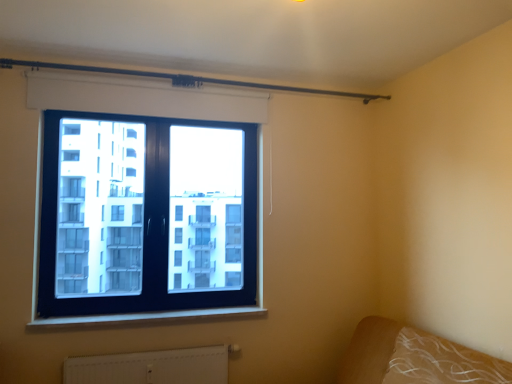
Describe the element at coordinates (147, 317) in the screenshot. This screenshot has width=512, height=384. I see `white plastic window sill at lower center` at that location.

Describe the element at coordinates (151, 367) in the screenshot. I see `white textured radiator at lower center` at that location.

What do you see at coordinates (414, 358) in the screenshot? I see `brown fabric bed at lower right` at bounding box center [414, 358].

Identify the location of white plastic window sill at lower center. (147, 317).

Does point (410, 375) appear closer or farther from the camera than point (158, 318)?

Point (410, 375) is closer to the camera than point (158, 318).

Is brown fabric bed at lower right next to white plastic window sill at lower center and touching it?

No, brown fabric bed at lower right is not next to white plastic window sill at lower center.

From the picture: Can you confirm if brown fabric bed at lower right is bigger than white plastic window sill at lower center?

Correct, brown fabric bed at lower right is larger in size than white plastic window sill at lower center.

Choose the correct answer: Is brown fabric bed at lower right inside white plastic window sill at lower center or outside it?

brown fabric bed at lower right is not inside white plastic window sill at lower center, it's outside.

Consider the image. From the image's perspective, which one is positioned lower, white plastic window sill at lower center or brown fabric bed at lower right?

brown fabric bed at lower right.

Considering the sizes of white plastic window sill at lower center and brown fabric bed at lower right in the image, is white plastic window sill at lower center bigger or smaller than brown fabric bed at lower right?

In the image, white plastic window sill at lower center appears to be smaller than brown fabric bed at lower right.

Which is more to the right, white plastic window sill at lower center or brown fabric bed at lower right?

Positioned to the right is brown fabric bed at lower right.

From the picture: Can you confirm if white plastic window sill at lower center is taller than brown fabric bed at lower right?

In fact, white plastic window sill at lower center may be shorter than brown fabric bed at lower right.

Is white textured radiator at lower center further to the viewer compared to white plastic window sill at lower center?

No, it is in front of white plastic window sill at lower center.

Who is smaller, white textured radiator at lower center or white plastic window sill at lower center?

white plastic window sill at lower center is smaller.

What are the coordinates of `window sill positioned vertically above the white textured radiator at lower center (from a real-world perspective)` in the screenshot? It's located at (147, 317).

Who is shorter, brown fabric bed at lower right or black glass window at upper left?

brown fabric bed at lower right.

From a real-world perspective, is brown fabric bed at lower right under black glass window at upper left?

Indeed, from a real-world perspective, brown fabric bed at lower right is positioned beneath black glass window at upper left.

Considering the relative positions of brown fabric bed at lower right and black glass window at upper left in the image provided, is brown fabric bed at lower right to the left of black glass window at upper left from the viewer's perspective?

No, brown fabric bed at lower right is not to the left of black glass window at upper left.

In the scene shown: Does brown fabric bed at lower right have a lesser width compared to metallic rod at upper center?

Incorrect, the width of brown fabric bed at lower right is not less than that of metallic rod at upper center.

Looking at this image, is brown fabric bed at lower right taller or shorter than metallic rod at upper center?

Considering their sizes, brown fabric bed at lower right has more height than metallic rod at upper center.

From the picture: Is brown fabric bed at lower right looking in the opposite direction of metallic rod at upper center?

No.

Is metallic rod at upper center wider than white plastic window sill at lower center?

In fact, metallic rod at upper center might be narrower than white plastic window sill at lower center.

Is white plastic window sill at lower center inside metallic rod at upper center?

No, white plastic window sill at lower center is located outside of metallic rod at upper center.

From a real-world perspective, between metallic rod at upper center and white plastic window sill at lower center, who is vertically higher?

In real-world perspective, metallic rod at upper center is above.

In the scene shown: Are metallic rod at upper center and white plastic window sill at lower center making contact?

metallic rod at upper center and white plastic window sill at lower center are not in contact.

Would you say black glass window at upper left is to the left or to the right of brown fabric bed at lower right in the picture?

In the image, black glass window at upper left appears on the left side of brown fabric bed at lower right.

In terms of size, does black glass window at upper left appear bigger or smaller than brown fabric bed at lower right?

black glass window at upper left is smaller than brown fabric bed at lower right.

Considering the sizes of objects black glass window at upper left and brown fabric bed at lower right in the image provided, who is shorter, black glass window at upper left or brown fabric bed at lower right?

Standing shorter between the two is brown fabric bed at lower right.

From the image's perspective, which one is positioned lower, black glass window at upper left or brown fabric bed at lower right?

From the image's view, brown fabric bed at lower right is below.

You are a GUI agent. You are given a task and a screenshot of the screen. Output one action in this format:
    pyautogui.click(x=<x>, y=<y>)
    Task: Click on the window sill above the brown fabric bed at lower right (from the image's perspective)
    The height and width of the screenshot is (384, 512).
    Given the screenshot: What is the action you would take?
    click(147, 317)

The width and height of the screenshot is (512, 384). Identify the location of bed frame that is in front of the white plastic window sill at lower center. (414, 358).

Which object lies further to the anchor point metallic rod at upper center, black glass window at upper left or brown fabric bed at lower right?

brown fabric bed at lower right is further to metallic rod at upper center.

Looking at the image, which one is located further to white textured radiator at lower center, black glass window at upper left or white plastic window sill at lower center?

The object further to white textured radiator at lower center is black glass window at upper left.

Looking at the image, which one is located closer to white textured radiator at lower center, metallic rod at upper center or white plastic window sill at lower center?

white plastic window sill at lower center.

Which object lies further to the anchor point white textured radiator at lower center, brown fabric bed at lower right or black glass window at upper left?

black glass window at upper left is further to white textured radiator at lower center.

Which object lies further to the anchor point metallic rod at upper center, white plastic window sill at lower center or black glass window at upper left?

The object further to metallic rod at upper center is white plastic window sill at lower center.

From the image, which object appears to be farther from white textured radiator at lower center, white plastic window sill at lower center or metallic rod at upper center?

metallic rod at upper center lies further to white textured radiator at lower center than the other object.

Estimate the real-world distances between objects in this image. Which object is closer to white textured radiator at lower center, brown fabric bed at lower right or white plastic window sill at lower center?

white plastic window sill at lower center is closer to white textured radiator at lower center.

Estimate the real-world distances between objects in this image. Which object is further from black glass window at upper left, white textured radiator at lower center or metallic rod at upper center?

white textured radiator at lower center is positioned further to the anchor black glass window at upper left.

Identify the location of bed frame between metallic rod at upper center and white textured radiator at lower center in the vertical direction. The height and width of the screenshot is (384, 512). (414, 358).

Where is `window between metallic rod at upper center and white plastic window sill at lower center in the up-down direction`? window between metallic rod at upper center and white plastic window sill at lower center in the up-down direction is located at coordinates (148, 115).

This screenshot has width=512, height=384. I want to click on window between metallic rod at upper center and white textured radiator at lower center in the up-down direction, so click(x=148, y=115).

This screenshot has width=512, height=384. In order to click on window sill between metallic rod at upper center and brown fabric bed at lower right in the up-down direction in this screenshot , I will do `click(147, 317)`.